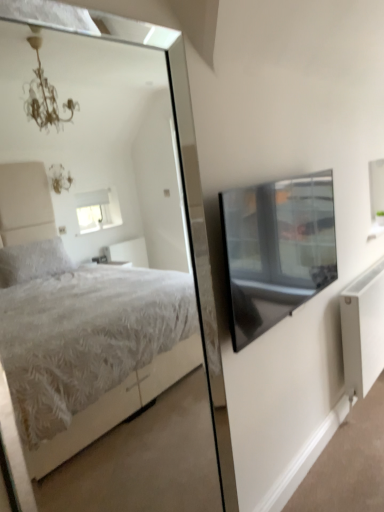
Question: Is white textured bed at center completely or partially outside of white matte radiator at lower right?

Choices:
 (A) no
 (B) yes

Answer: (B)

Question: From the image's perspective, is white textured bed at center beneath white matte radiator at lower right?

Choices:
 (A) no
 (B) yes

Answer: (A)

Question: From the image's perspective, would you say white textured bed at center is positioned over white matte radiator at lower right?

Choices:
 (A) yes
 (B) no

Answer: (A)

Question: Does white textured bed at center have a greater height compared to white matte radiator at lower right?

Choices:
 (A) yes
 (B) no

Answer: (A)

Question: Does white textured bed at center have a smaller size compared to white matte radiator at lower right?

Choices:
 (A) yes
 (B) no

Answer: (A)

Question: Considering the relative positions of white textured bed at center and white matte radiator at lower right in the image provided, is white textured bed at center to the right of white matte radiator at lower right from the viewer's perspective?

Choices:
 (A) yes
 (B) no

Answer: (B)

Question: Are white matte radiator at lower right and transparent glass window screen at upper right far apart?

Choices:
 (A) yes
 (B) no

Answer: (B)

Question: Does white matte radiator at lower right have a smaller size compared to transparent glass window screen at upper right?

Choices:
 (A) no
 (B) yes

Answer: (A)

Question: Does white matte radiator at lower right have a greater height compared to transparent glass window screen at upper right?

Choices:
 (A) no
 (B) yes

Answer: (B)

Question: From a real-world perspective, is white matte radiator at lower right under transparent glass window screen at upper right?

Choices:
 (A) no
 (B) yes

Answer: (B)

Question: Is white matte radiator at lower right closer to the viewer compared to transparent glass window screen at upper right?

Choices:
 (A) yes
 (B) no

Answer: (B)

Question: From the image's perspective, is white matte radiator at lower right located above transparent glass window screen at upper right?

Choices:
 (A) yes
 (B) no

Answer: (B)

Question: Are white matte radiator at lower right and white textured bed at center far apart?

Choices:
 (A) no
 (B) yes

Answer: (B)